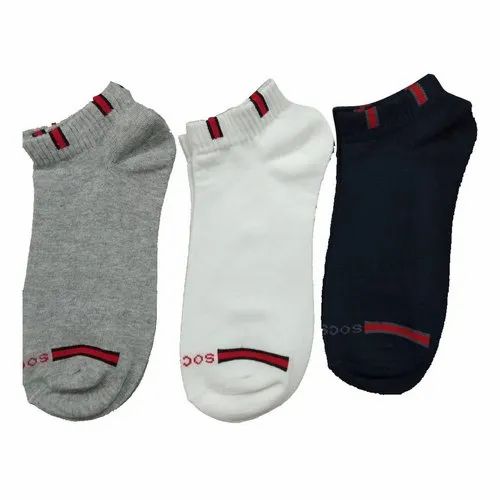
You are a GUI agent. You are given a task and a screenshot of the screen. Output one action in this format:
    pyautogui.click(x=<x>, y=<y>)
    Task: Click on the grey sock
    Image resolution: width=500 pixels, height=500 pixels.
    Given the screenshot: What is the action you would take?
    pyautogui.click(x=60, y=241)